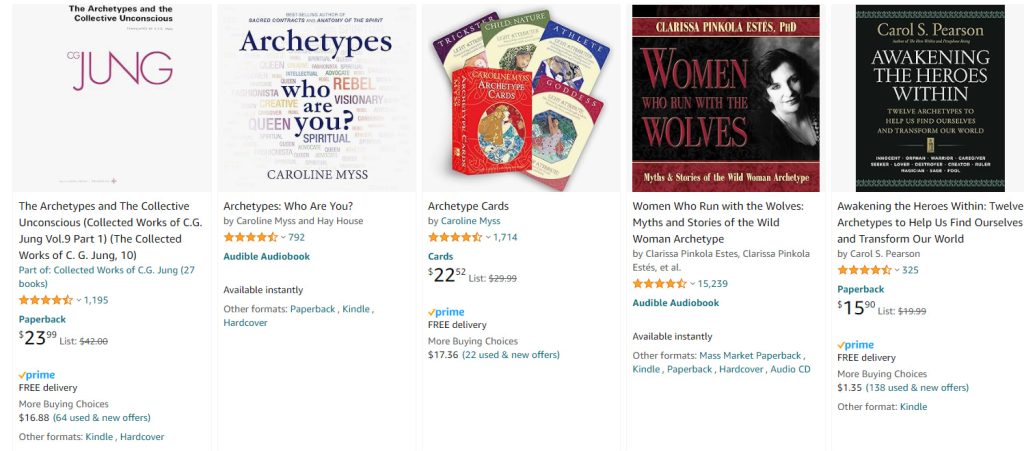
Find the location of a particular element. This screenshot has width=1024, height=451. book is located at coordinates (324, 94), (717, 98), (916, 103), (450, 56), (508, 36), (559, 69), (568, 116), (169, 131).